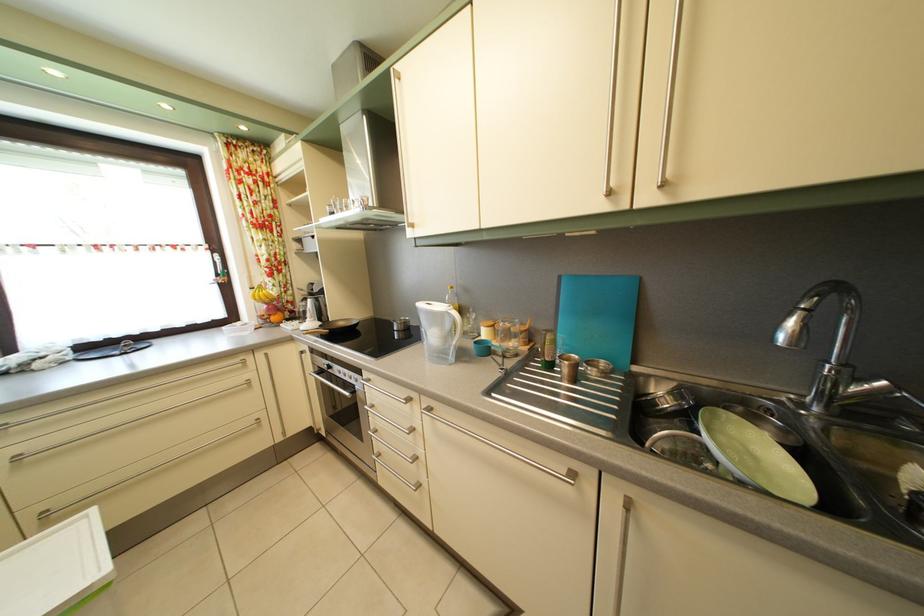
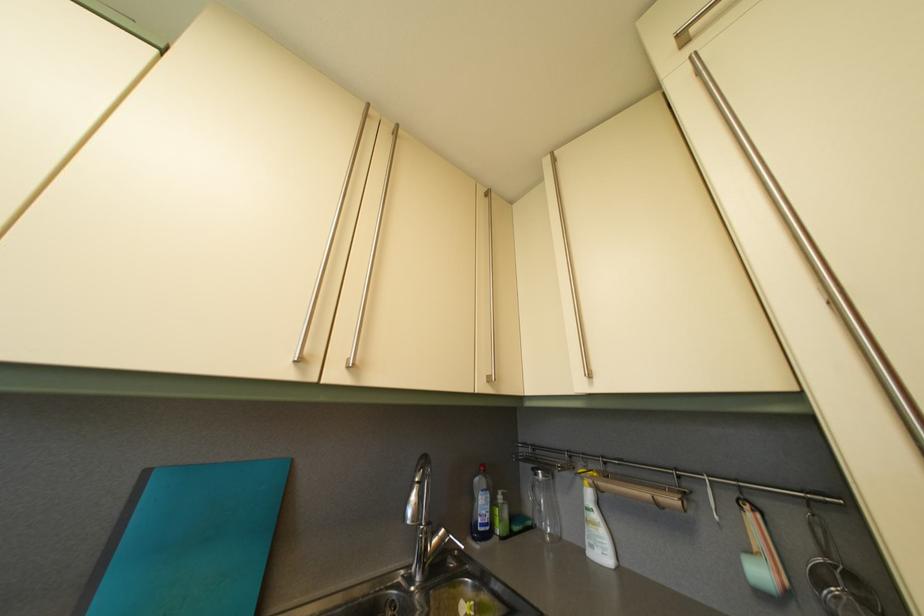
In the second image, find the point that corresponds to point (567, 285) in the first image.

(154, 480)